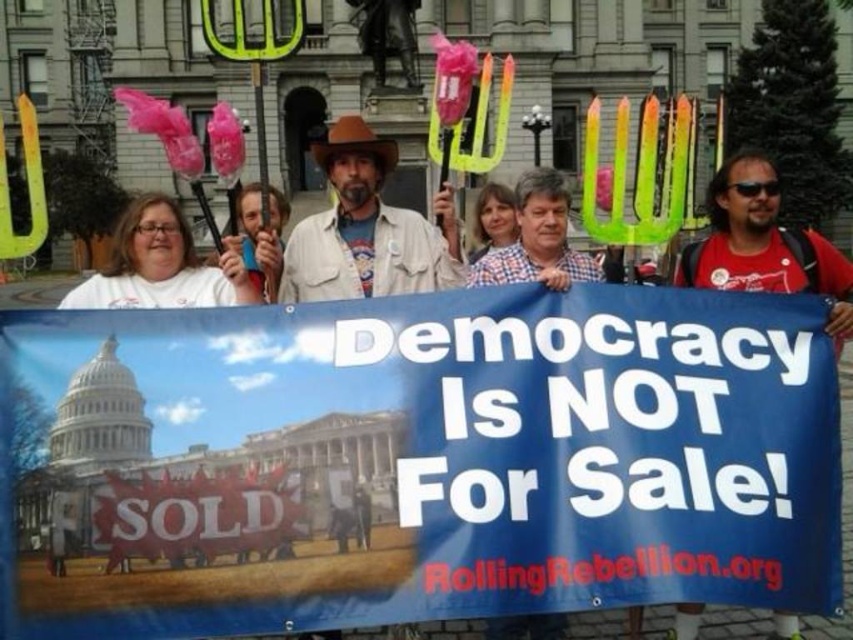
You are a photographer trying to capture a closeup of the red matte shirt at center and the checkered shirt at center in the protest scene. Given that your camera has a maximum focus range of 10 meters, will you be able to photograph both shirts clearly in the same frame?

The distance between the red matte shirt at center and the checkered shirt at center is 9.71 meters, which is within the camera maximum focus range of 10 meters. Therefore, you can photograph both shirts clearly in the same frame.